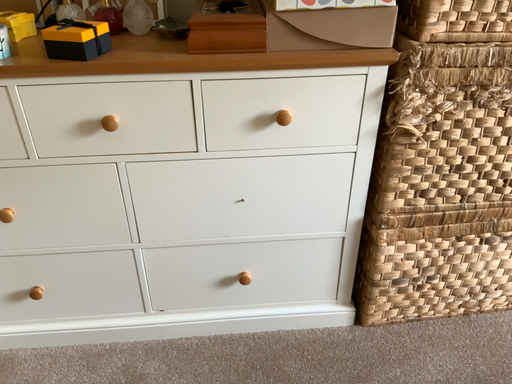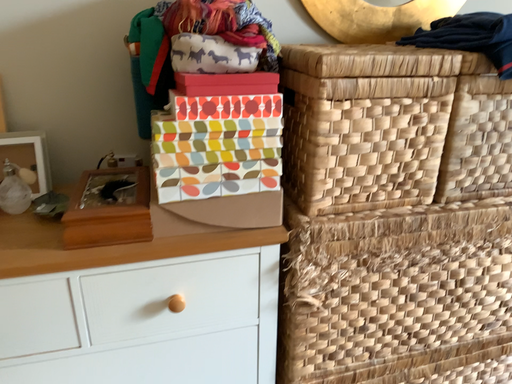
Question: How did the camera likely rotate when shooting the video?

Choices:
 (A) rotated left
 (B) rotated right

Answer: (B)